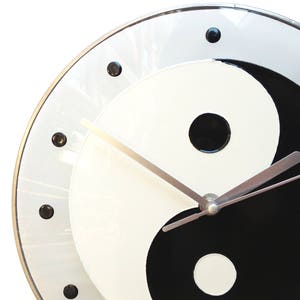
Locate an element on the screen. This screenshot has height=300, width=300. gray rim around clock face is located at coordinates (47, 243).